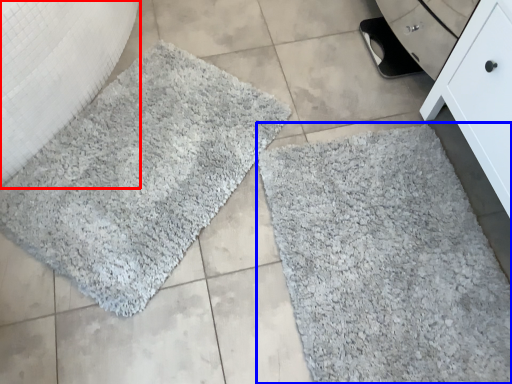
Question: Which point is closer to the camera, granite (highlighted by a red box) or bath mat (highlighted by a blue box)?

Choices:
 (A) granite
 (B) bath mat

Answer: (A)